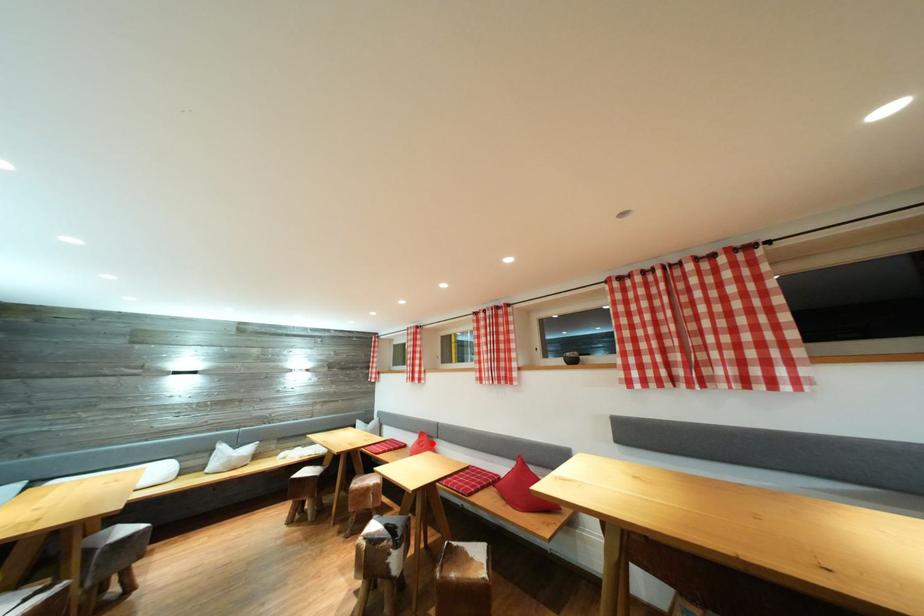
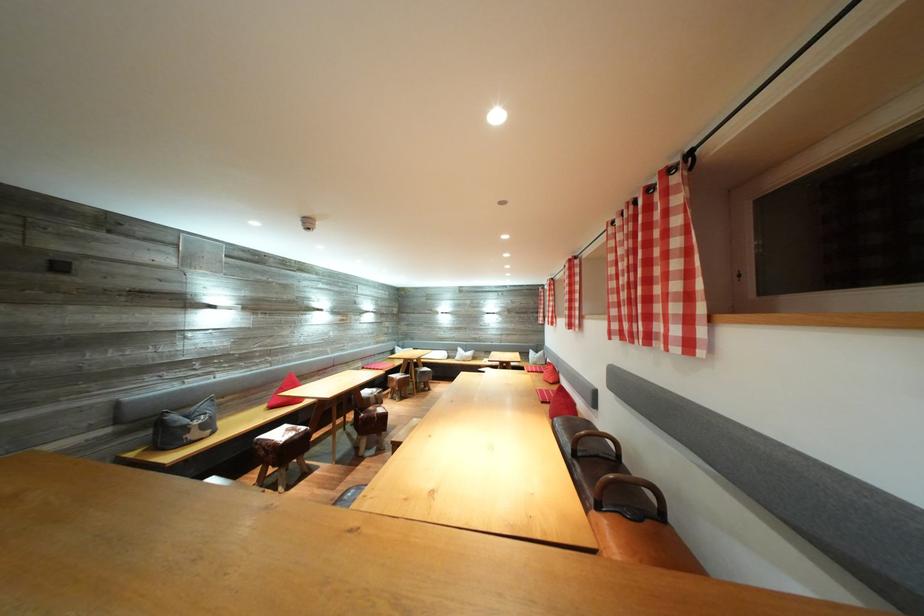
Question: A red point is marked in image1. In image2, is the corresponding 3D point closer to the camera or farther? Reply with the corresponding letter.

Choices:
 (A) The corresponding 3D point is closer.
 (B) The corresponding 3D point is farther.

Answer: (A)